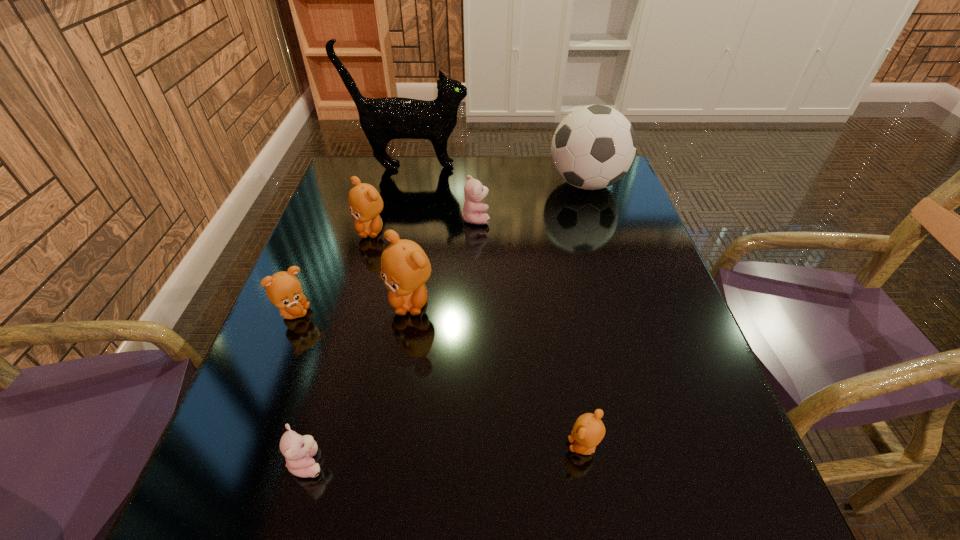
Where is `cat`? Image resolution: width=960 pixels, height=540 pixels. cat is located at coordinates (382, 119).

In order to click on black cat in this screenshot , I will do `click(382, 119)`.

Locate an element on the screen. The height and width of the screenshot is (540, 960). black soccer ball is located at coordinates (593, 147).

At what (x,y) coordinates should I click in order to perform the action: click on the second tallest object. Please return your answer as a coordinate pair (x, y). This screenshot has height=540, width=960. Looking at the image, I should click on (593, 147).

Where is `the fourth teddy bear from left to right`? The image size is (960, 540). the fourth teddy bear from left to right is located at coordinates (405, 268).

You are a GUI agent. You are given a task and a screenshot of the screen. Output one action in this format:
    pyautogui.click(x=<x>, y=<y>)
    Task: Click on the sixth shortest object
    Image resolution: width=960 pixels, height=540 pixels.
    Given the screenshot: What is the action you would take?
    pyautogui.click(x=405, y=268)

Locate an element on the screen. the third smallest brown teddy bear is located at coordinates (365, 203).

Identify the location of the fifth shortest object. (365, 203).

Find the location of a particular element. the leftmost teddy bear is located at coordinates (283, 289).

At what (x,y) coordinates should I click in order to perform the action: click on the leftmost brown teddy bear. Please return your answer as a coordinate pair (x, y). Looking at the image, I should click on (283, 289).